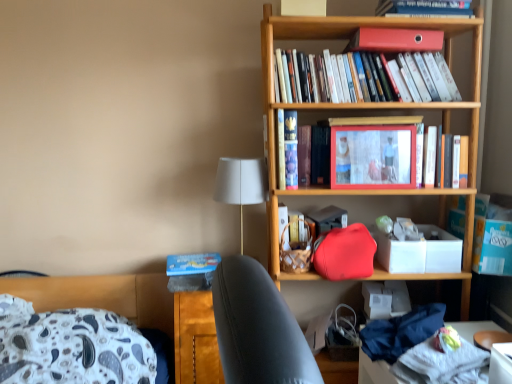
In order to click on free space above white matte box at center-right (from a real-world perspective) in this screenshot , I will do `click(409, 230)`.